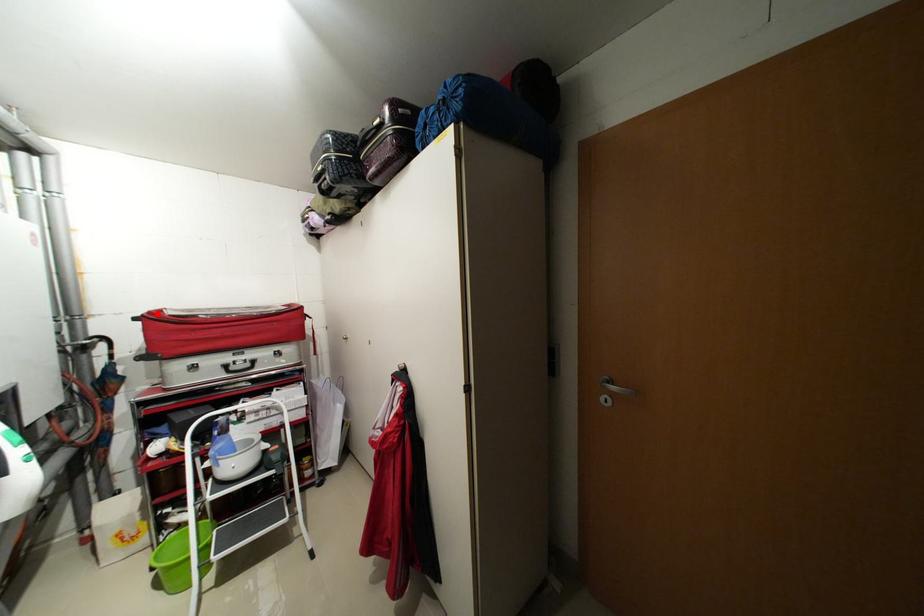
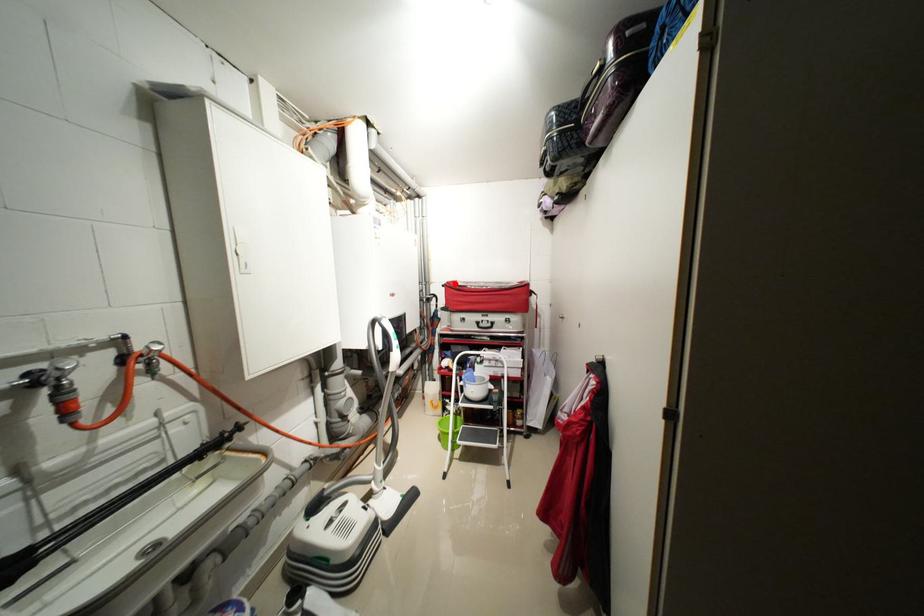
I am providing you with two images of the same scene from different viewpoints. A red point is marked on the first image and another point is marked on the second image. Is the red point in image1 aligned with the point shown in image2?

Yes